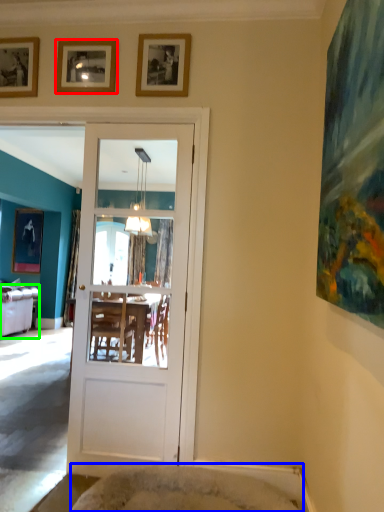
Question: Estimate the real-world distances between objects in this image. Which object is farther from picture frame (highlighted by a red box), cat bed (highlighted by a blue box) or studio couch (highlighted by a green box)?

Choices:
 (A) cat bed
 (B) studio couch

Answer: (B)